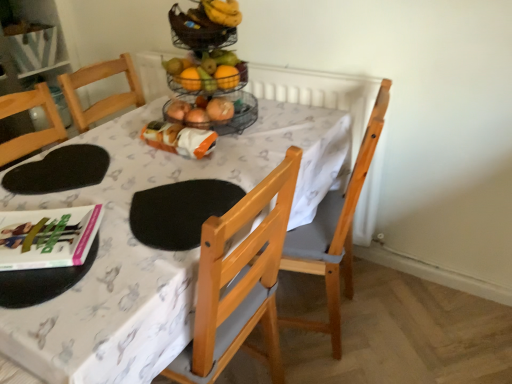
Question: From a real-world perspective, is hardcover book at lower left physically located above or below white fabric table at center?

Choices:
 (A) above
 (B) below

Answer: (A)

Question: In terms of width, does hardcover book at lower left look wider or thinner when compared to white fabric table at center?

Choices:
 (A) thin
 (B) wide

Answer: (A)

Question: Which object is the closest to the hardcover book at lower left?

Choices:
 (A) black mesh basket at upper center
 (B) black foam mat at upper left
 (C) orange matte grapefruit at upper center
 (D) orange plastic bag at center
 (E) white fabric table at center

Answer: (B)

Question: Based on their relative distances, which object is nearer to the hardcover book at lower left?

Choices:
 (A) black foam mat at upper left
 (B) white fabric table at center
 (C) black mesh basket at upper center
 (D) light brown wooden chair at center
 (E) orange plastic bag at center

Answer: (A)